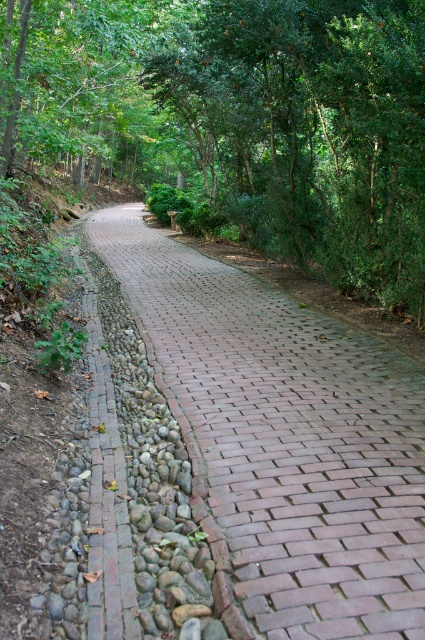
Based on the photo, you are standing on the brick pathway and see two points marked in the scene. Which point is closer to you, point [164,124] or point [404,577]?

Point [164,124] is closer to you because it is further to the viewer than point [404,577].

You are standing at point (x=240, y=116) in the forest. What do you see around you?

At point (x=240, y=116), you are surrounded by green leafy forest at center.

You are standing on the brick paved path at center and want to walk towards the green leafy forest at center. Which direction should you turn to reach it?

The green leafy forest at center is to the left of the brick paved path at center, so you should turn left to reach it.